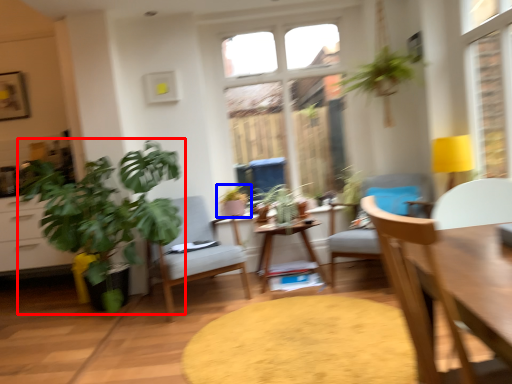
Question: Which point is further to the camera, houseplant (highlighted by a red box) or houseplant (highlighted by a blue box)?

Choices:
 (A) houseplant
 (B) houseplant

Answer: (B)